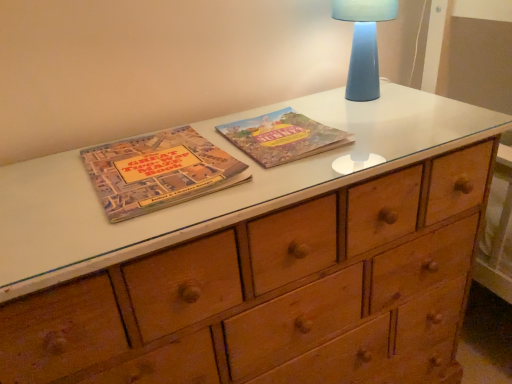
Describe the element at coordinates (282, 137) in the screenshot. I see `matte paper book at center, the first paperback book from the right` at that location.

At what (x,y) coordinates should I click in order to perform the action: click on blue ceramic lamp at upper right. Please return your answer as a coordinate pair (x, y). The width and height of the screenshot is (512, 384). Looking at the image, I should click on (364, 44).

Locate an element on the screen. The image size is (512, 384). matte cardboard book at center-left, placed as the 1th paperback book when sorted from left to right is located at coordinates pyautogui.click(x=158, y=172).

Is blue ceramic lamp at upper right placed right next to matte paper book at center, which appears as the 2th paperback book when viewed from the left?

No, blue ceramic lamp at upper right is not in contact with matte paper book at center, which appears as the 2th paperback book when viewed from the left.

Considering the sizes of blue ceramic lamp at upper right and matte paper book at center, which appears as the 2th paperback book when viewed from the left, in the image, is blue ceramic lamp at upper right taller or shorter than matte paper book at center, which appears as the 2th paperback book when viewed from the left,?

blue ceramic lamp at upper right is taller than matte paper book at center, which appears as the 2th paperback book when viewed from the left.

From a real-world perspective, is blue ceramic lamp at upper right physically above matte paper book at center, which appears as the 2th paperback book when viewed from the left?

Yes, from a real-world perspective, blue ceramic lamp at upper right is over matte paper book at center, which appears as the 2th paperback book when viewed from the left

From a real-world perspective, is matte paper book at center, the first paperback book from the right, located beneath matte cardboard book at center-left, placed as the 1th paperback book when sorted from left to right?

Yes, from a real-world perspective, matte paper book at center, the first paperback book from the right, is below matte cardboard book at center-left, placed as the 1th paperback book when sorted from left to right.

Is the position of matte paper book at center, which appears as the 2th paperback book when viewed from the left, less distant than that of matte cardboard book at center-left, placed as the 1th paperback book when sorted from left to right?

That is False.

Would you say matte paper book at center, which appears as the 2th paperback book when viewed from the left, is a long distance from matte cardboard book at center-left, the second paperback book viewed from the right?

No, matte paper book at center, which appears as the 2th paperback book when viewed from the left, is not far from matte cardboard book at center-left, the second paperback book viewed from the right.

Does matte cardboard book at center-left, placed as the 1th paperback book when sorted from left to right, appear on the right side of blue ceramic lamp at upper right?

No.

Considering the relative sizes of matte cardboard book at center-left, the second paperback book viewed from the right, and blue ceramic lamp at upper right in the image provided, is matte cardboard book at center-left, the second paperback book viewed from the right, shorter than blue ceramic lamp at upper right?

Yes.

Between matte cardboard book at center-left, placed as the 1th paperback book when sorted from left to right, and blue ceramic lamp at upper right, which one is positioned behind?

blue ceramic lamp at upper right.

Can you tell me how much matte cardboard book at center-left, placed as the 1th paperback book when sorted from left to right, and blue ceramic lamp at upper right differ in facing direction?

The facing directions of matte cardboard book at center-left, placed as the 1th paperback book when sorted from left to right, and blue ceramic lamp at upper right are 0.000618 degrees apart.

Which point is more forward, (x=303, y=146) or (x=359, y=99)?

The point (x=303, y=146) is closer to the camera.

Is matte paper book at center, the first paperback book from the right, facing away from blue ceramic lamp at upper right?

No, matte paper book at center, the first paperback book from the right, is not facing the opposite direction of blue ceramic lamp at upper right.

From the image's perspective, would you say matte paper book at center, the first paperback book from the right, is shown under blue ceramic lamp at upper right?

Yes.

This screenshot has width=512, height=384. Identify the location of bedside lamp above the matte cardboard book at center-left, the second paperback book viewed from the right (from a real-world perspective). (364, 44).

Does blue ceramic lamp at upper right appear on the left side of matte cardboard book at center-left, placed as the 1th paperback book when sorted from left to right?

No.

Considering the positions of point (360, 24) and point (119, 187), is point (360, 24) closer or farther from the camera than point (119, 187)?

Point (360, 24).

From the image's perspective, is matte cardboard book at center-left, the second paperback book viewed from the right, over matte paper book at center, the first paperback book from the right?

No, from the image's perspective, matte cardboard book at center-left, the second paperback book viewed from the right, is not above matte paper book at center, the first paperback book from the right.

Which object is positioned more to the right, matte cardboard book at center-left, placed as the 1th paperback book when sorted from left to right, or matte paper book at center, the first paperback book from the right?

matte paper book at center, the first paperback book from the right.

Is matte cardboard book at center-left, placed as the 1th paperback book when sorted from left to right, looking in the opposite direction of matte paper book at center, the first paperback book from the right?

matte cardboard book at center-left, placed as the 1th paperback book when sorted from left to right, does not have its back to matte paper book at center, the first paperback book from the right.

Considering the relative sizes of matte cardboard book at center-left, the second paperback book viewed from the right, and matte paper book at center, the first paperback book from the right, in the image provided, is matte cardboard book at center-left, the second paperback book viewed from the right, smaller than matte paper book at center, the first paperback book from the right,?

Answer: Incorrect, matte cardboard book at center-left, the second paperback book viewed from the right, is not smaller in size than matte paper book at center, the first paperback book from the right.

Locate an element on the screen. the 1st paperback book below when counting from the blue ceramic lamp at upper right (from the image's perspective) is located at coordinates (282, 137).

This screenshot has height=384, width=512. In order to click on paperback book located on the right of matte cardboard book at center-left, the second paperback book viewed from the right in this screenshot , I will do `click(282, 137)`.

From the image, which object appears to be farther from matte cardboard book at center-left, placed as the 1th paperback book when sorted from left to right, matte paper book at center, the first paperback book from the right, or blue ceramic lamp at upper right?

blue ceramic lamp at upper right.

Consider the image. When comparing their distances from matte paper book at center, the first paperback book from the right, does blue ceramic lamp at upper right or matte cardboard book at center-left, the second paperback book viewed from the right, seem further?

Among the two, blue ceramic lamp at upper right is located further to matte paper book at center, the first paperback book from the right.

Looking at the image, which one is located further to blue ceramic lamp at upper right, matte cardboard book at center-left, placed as the 1th paperback book when sorted from left to right, or matte paper book at center, which appears as the 2th paperback book when viewed from the left?

matte cardboard book at center-left, placed as the 1th paperback book when sorted from left to right, is positioned further to the anchor blue ceramic lamp at upper right.

When comparing their distances from blue ceramic lamp at upper right, does matte paper book at center, which appears as the 2th paperback book when viewed from the left, or matte cardboard book at center-left, the second paperback book viewed from the right, seem closer?

matte paper book at center, which appears as the 2th paperback book when viewed from the left, lies closer to blue ceramic lamp at upper right than the other object.

Estimate the real-world distances between objects in this image. Which object is closer to matte cardboard book at center-left, the second paperback book viewed from the right, blue ceramic lamp at upper right or matte paper book at center, which appears as the 2th paperback book when viewed from the left?

matte paper book at center, which appears as the 2th paperback book when viewed from the left, is positioned closer to the anchor matte cardboard book at center-left, the second paperback book viewed from the right.

Which object lies further to the anchor point matte paper book at center, the first paperback book from the right, matte cardboard book at center-left, the second paperback book viewed from the right, or blue ceramic lamp at upper right?

Based on the image, blue ceramic lamp at upper right appears to be further to matte paper book at center, the first paperback book from the right.

I want to click on paperback book between matte cardboard book at center-left, the second paperback book viewed from the right, and blue ceramic lamp at upper right from left to right, so click(x=282, y=137).